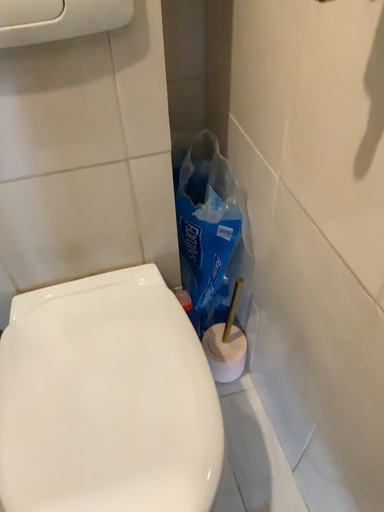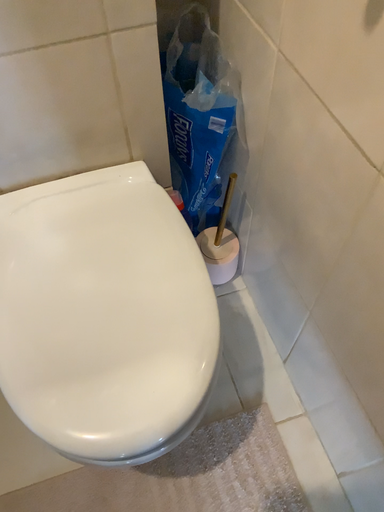
Question: How did the camera likely rotate when shooting the video?

Choices:
 (A) rotated upward
 (B) rotated downward

Answer: (B)